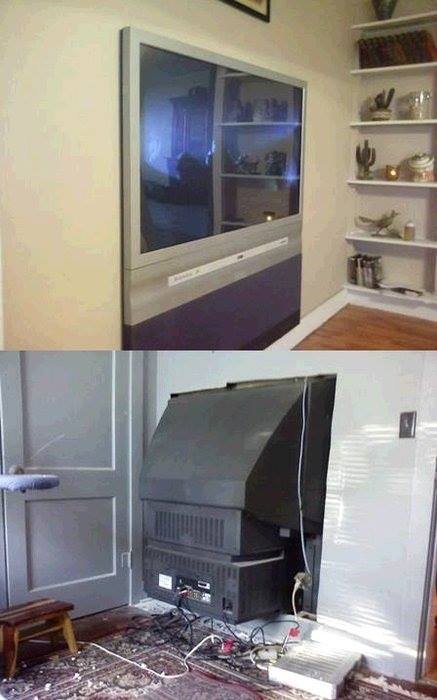
Find the location of a particular element. Image resolution: width=437 pixels, height=700 pixels. white colored wall is located at coordinates (368, 514).